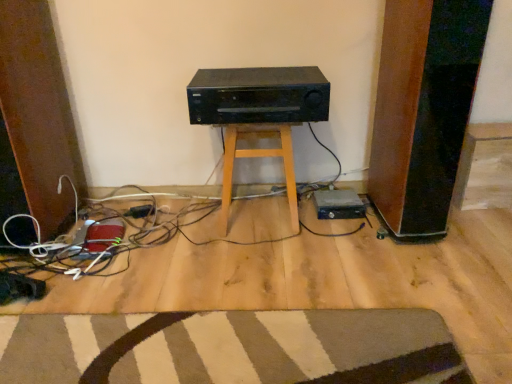
Locate an element on the screen. This screenshot has height=384, width=512. free space that is in between black plastic hard drive at lower right and black plastic plug at lower center is located at coordinates (234, 212).